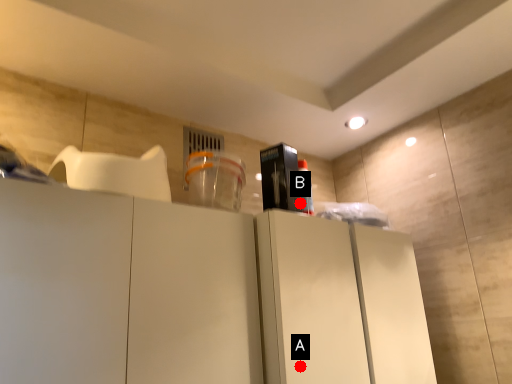
Question: Two points are circled on the image, labeled by A and B beside each circle. Which point appears closest to the camera in this image?

Choices:
 (A) A is closer
 (B) B is closer

Answer: (A)